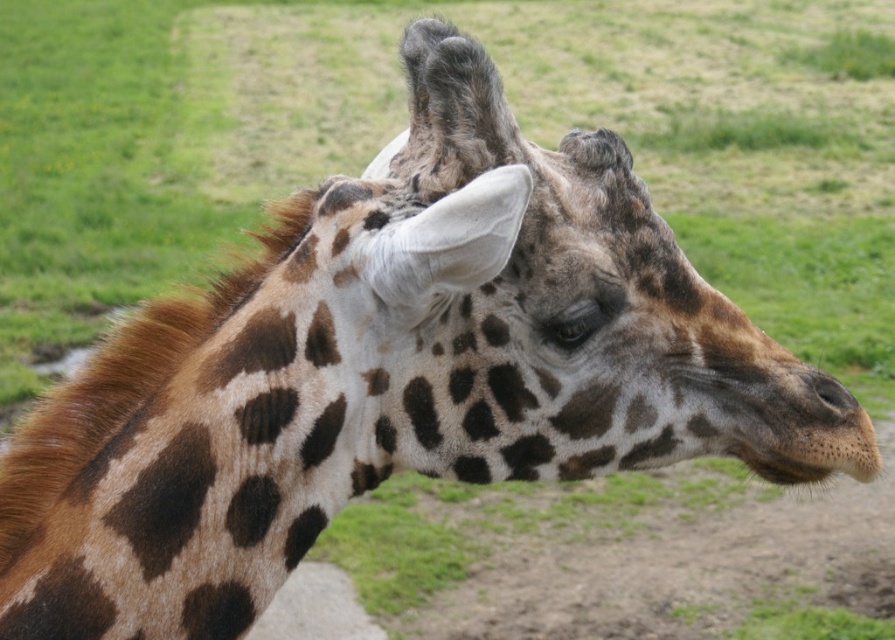
You are observing a giraffe in its habitat. You notice two areas of fur on its neck. The first is the brown spotted fur at center, and the second is the brown textured fur at center. Which of these two areas has a greater width?

The brown spotted fur at center has a greater width compared to the brown textured fur at center.

You are a wildlife photographer aiming to capture a closeup of the brown spotted fur at center and the brown textured nose at lower right. Which object should you focus on first if you want to ensure both are in sharp focus, considering their sizes?

The brown spotted fur at center is larger in size than the brown textured nose at lower right, so focusing on the brown spotted fur at center first would ensure both are in sharp focus since it is the larger object.

You are standing in front of the giraffe and want to touch the two points on its body. The first point is at coordinates point (501, 288) and the second point is at point (858, 404). Which point should you reach for first if you want to touch them in the order they appear from your perspective?

Point (501, 288) is in front of point (858, 404), so you should reach for point (501, 288) first.